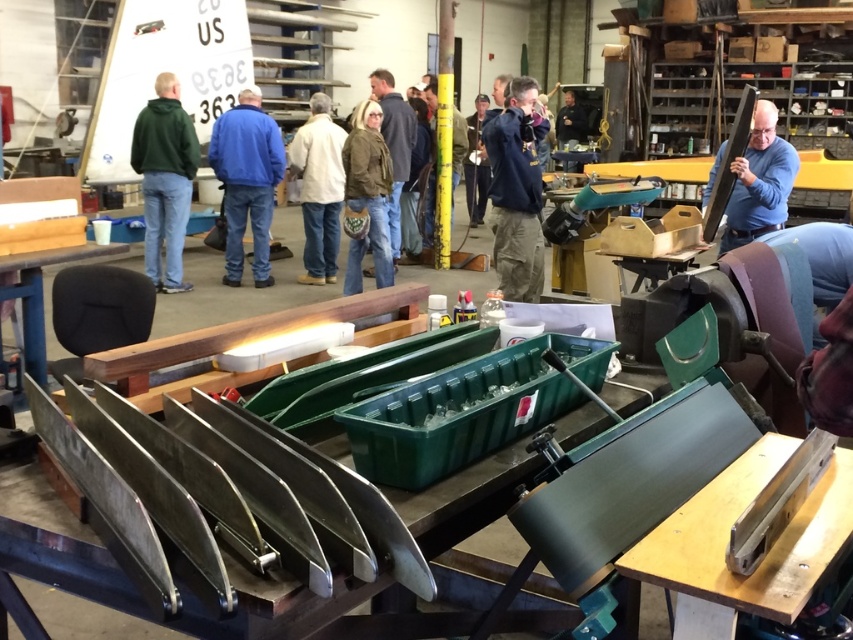
Measure the distance from dark blue jacket at center to yellow matte pole at center.

dark blue jacket at center and yellow matte pole at center are 2.69 meters apart from each other.

Between dark blue jacket at center and yellow matte pole at center, which one has more height?

yellow matte pole at center

At what (x,y) coordinates should I click in order to perform the action: click on dark blue jacket at center. Please return your answer as a coordinate pair (x, y). The image size is (853, 640). Looking at the image, I should click on (515, 192).

Is point (503, 252) positioned behind point (397, 144)?

No, it is not.

Who is lower down, dark blue jacket at center or brown leather jacket at center?

dark blue jacket at center is lower down.

Is point (529, 285) behind point (396, 211)?

No, it is not.

I want to click on dark blue jacket at center, so click(x=515, y=192).

Which is below, blue cotton jacket at center or white matte jacket at center?

white matte jacket at center is below.

Between point (260, 128) and point (322, 240), which one is positioned in front?

Point (260, 128) is in front.

The width and height of the screenshot is (853, 640). Identify the location of blue cotton jacket at center. (247, 180).